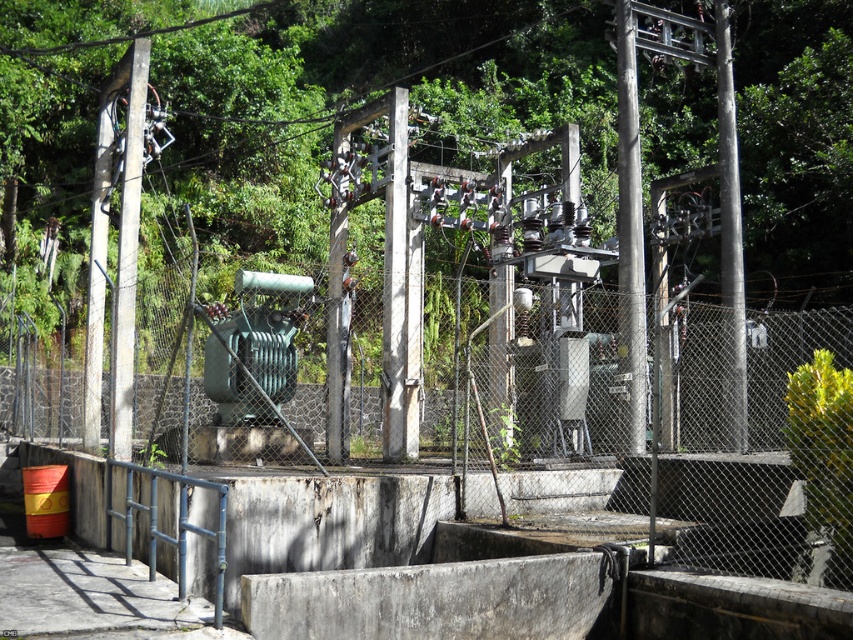
Does smooth gray pole at right have a larger size compared to smooth concrete pole at left?

No, smooth gray pole at right is not bigger than smooth concrete pole at left.

Is smooth gray pole at right wider than smooth concrete pole at left?

In fact, smooth gray pole at right might be narrower than smooth concrete pole at left.

Between point (740, 406) and point (126, 157), which one is positioned in front?

Positioned in front is point (126, 157).

This screenshot has height=640, width=853. I want to click on smooth gray pole at right, so click(x=730, y=237).

Is white concrete pole at center wider than rusty metal pole at center?

Yes, white concrete pole at center is wider than rusty metal pole at center.

Does point (404, 132) come closer to viewer compared to point (637, 243)?

No, it is behind (637, 243).

You are a GUI agent. You are given a task and a screenshot of the screen. Output one action in this format:
    pyautogui.click(x=<x>, y=<y>)
    Task: Click on the white concrete pole at center
    Image resolution: width=853 pixels, height=640 pixels.
    Given the screenshot: What is the action you would take?
    pyautogui.click(x=399, y=296)

Does point (637, 422) lie in front of point (119, 385)?

No, (637, 422) is further to viewer.

Describe the element at coordinates (630, 236) in the screenshot. I see `rusty metal pole at center` at that location.

Image resolution: width=853 pixels, height=640 pixels. Find the location of `rusty metal pole at center`. rusty metal pole at center is located at coordinates (630, 236).

Identify the location of rusty metal pole at center. The width and height of the screenshot is (853, 640). (630, 236).